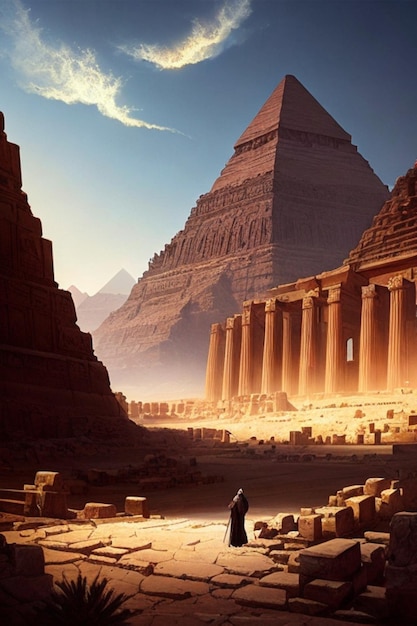
The height and width of the screenshot is (626, 417). In order to click on plant in this screenshot , I will do `click(68, 613)`.